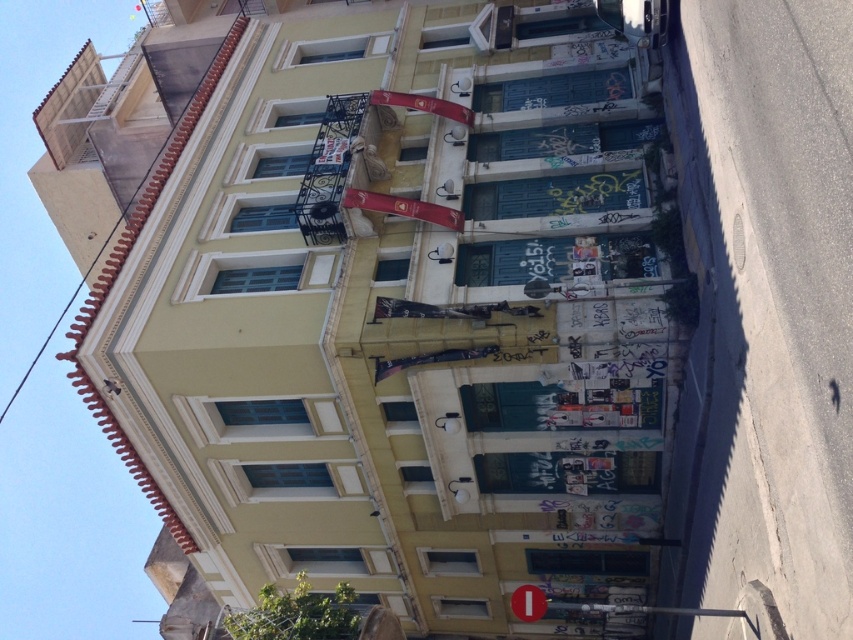
You are standing in front of the building and want to locate the metallic banner at center. According to the coordinates provided, where should you look relative to the building?

The metallic banner at center is located at coordinates point (x=403, y=208), so you should look towards the lower central area of the building.

You are standing at the front entrance of the building and want to reach the asphalt at lower right. Which direction should you walk to reach it?

The asphalt at lower right is located at point (764, 310), so you should walk towards the lower right direction to reach it.

You are a window installer assessing the building facade. You need to determine if the metallic banner at center can be replaced with a new one that is as wide as the red fabric flag at upper center. Based on the current dimensions, is this feasible?

The metallic banner at center is wider than the red fabric flag at upper center, so replacing it with a new one as wide as the red fabric flag at upper center would be feasible since the new banner would be narrower and fit within the existing space.